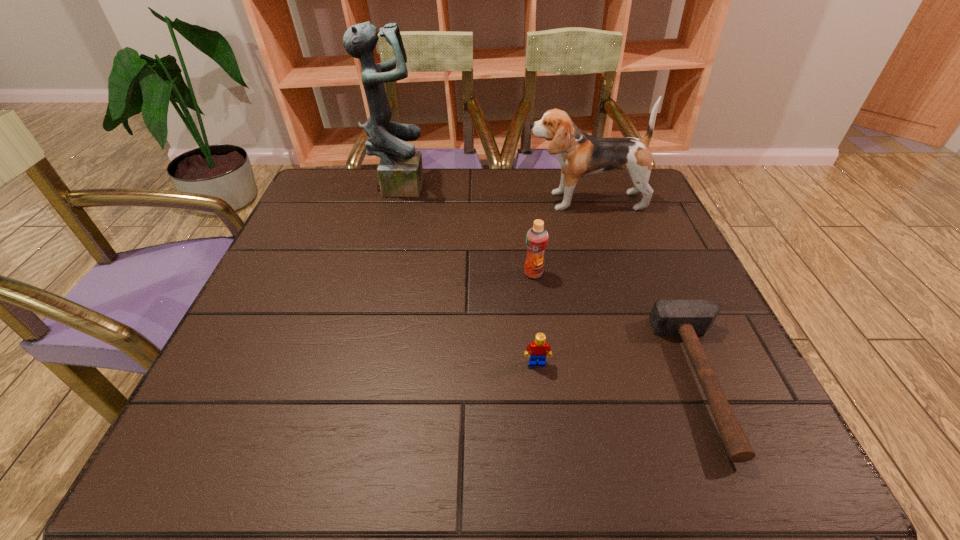
Where is `free spot that satisfies the following two spatial constraints: 1. at the face of the fourth shortest object; 2. on the front side of the third tallest object`? This screenshot has height=540, width=960. free spot that satisfies the following two spatial constraints: 1. at the face of the fourth shortest object; 2. on the front side of the third tallest object is located at coordinates (607, 273).

I want to click on blank space that satisfies the following two spatial constraints: 1. on the face of the third farthest object; 2. on the left side of the sculpture, so click(374, 273).

I want to click on free space that satisfies the following two spatial constraints: 1. at the face of the puppy; 2. on the front-facing side of the Lego, so click(635, 363).